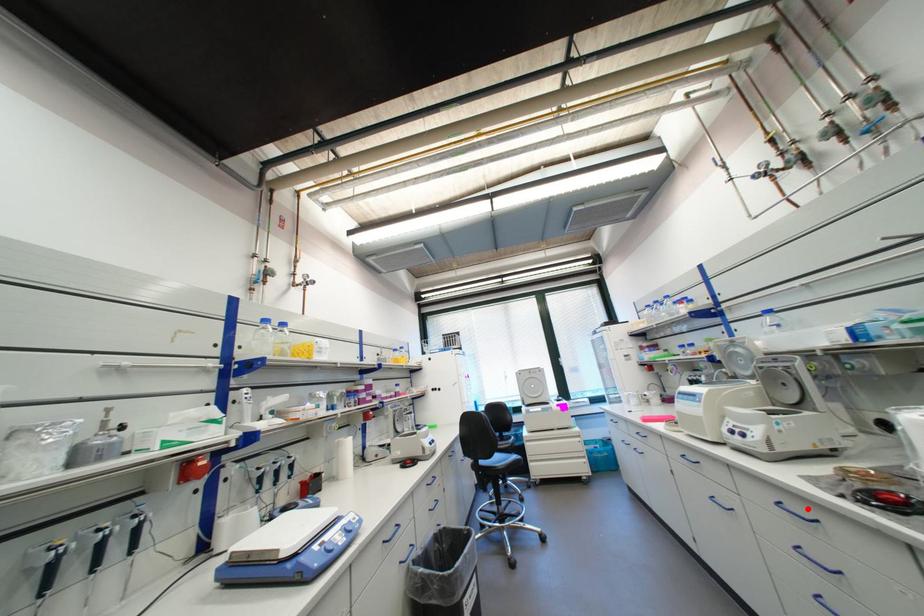
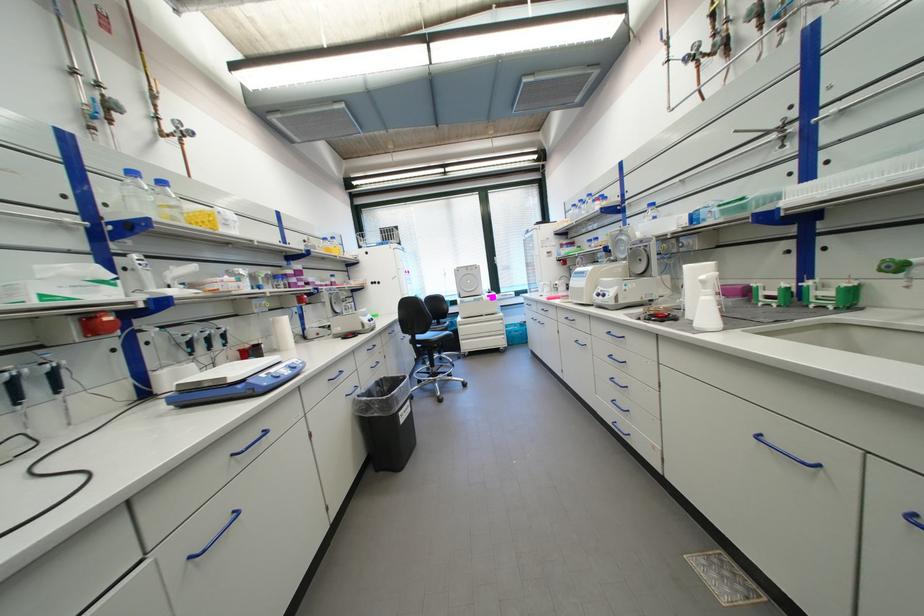
Question: I am providing you with two images of the same scene from different viewpoints. A red point is marked on the first image. Is the red point's position out of view in image 2?

Choices:
 (A) Yes
 (B) No

Answer: (B)